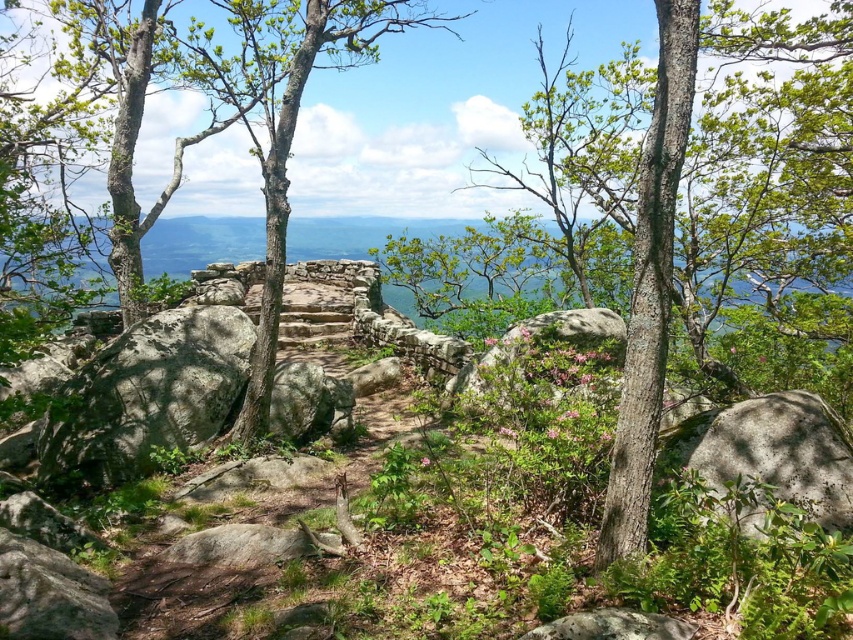
You are a hiker standing on the stone pathway and want to reach the gray rough rock at lower right. Which direction should you move relative to the gray rough rock at left?

You should move away from the gray rough rock at left towards the gray rough rock at lower right since the gray rough rock at left is closer to you than the gray rough rock at lower right.

You are an outdoor enthusiast planning a hike and need to navigate between the green rough bark tree at center and the gray rough rock at left. Based on the scene, which object is located higher in elevation?

The green rough bark tree at center is positioned over the gray rough rock at left, meaning it is higher in elevation than the rock.